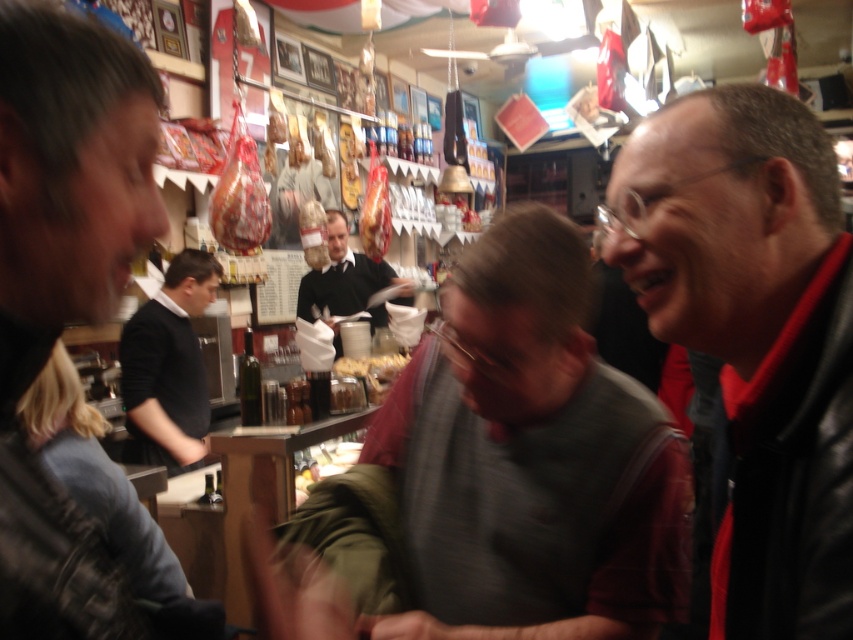
Can you confirm if gray zippered jacket at center is thinner than black leather jacket at center?

Correct, gray zippered jacket at center's width is less than black leather jacket at center's.

Is gray zippered jacket at center positioned before black leather jacket at center?

Yes, gray zippered jacket at center is closer to the viewer.

Identify the location of gray zippered jacket at center. Image resolution: width=853 pixels, height=640 pixels. (531, 458).

Consider the image. Does dark red leather jacket at right have a larger size compared to black shirt at left?

Actually, dark red leather jacket at right might be smaller than black shirt at left.

Based on the photo, does dark red leather jacket at right have a smaller size compared to black shirt at left?

Correct, dark red leather jacket at right occupies less space than black shirt at left.

The width and height of the screenshot is (853, 640). What are the coordinates of `dark red leather jacket at right` in the screenshot? It's located at (753, 333).

Where is `black shirt at left`? This screenshot has width=853, height=640. black shirt at left is located at coordinates (167, 368).

From the picture: Between black shirt at left and black leather jacket at center, which one is positioned higher?

Positioned higher is black leather jacket at center.

At what (x,y) coordinates should I click in order to perform the action: click on black shirt at left. Please return your answer as a coordinate pair (x, y). This screenshot has height=640, width=853. Looking at the image, I should click on (167, 368).

Where is `black shirt at left`? black shirt at left is located at coordinates (167, 368).